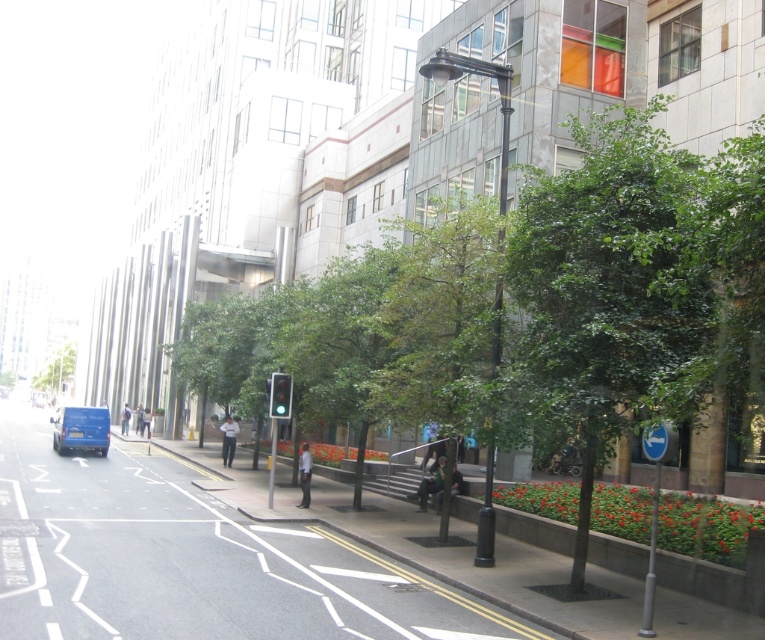
Question: Does smooth concrete pavement at center lie behind blue plastic sign at lower right?

Choices:
 (A) no
 (B) yes

Answer: (A)

Question: Does blue matte van at left come in front of green leafy tree at left?

Choices:
 (A) yes
 (B) no

Answer: (A)

Question: Among these points, which one is farthest from the camera?

Choices:
 (A) (20, 628)
 (B) (60, 436)
 (C) (649, 460)

Answer: (B)

Question: Among these objects, which one is farthest from the camera?

Choices:
 (A) blue matte van at left
 (B) green leafy tree at left

Answer: (B)

Question: Which of these objects is positioned farthest from the green leafy tree at left?

Choices:
 (A) blue plastic sign at lower right
 (B) blue matte van at left

Answer: (A)

Question: Is smooth concrete pavement at center further to the viewer compared to green leafy tree at left?

Choices:
 (A) no
 (B) yes

Answer: (A)